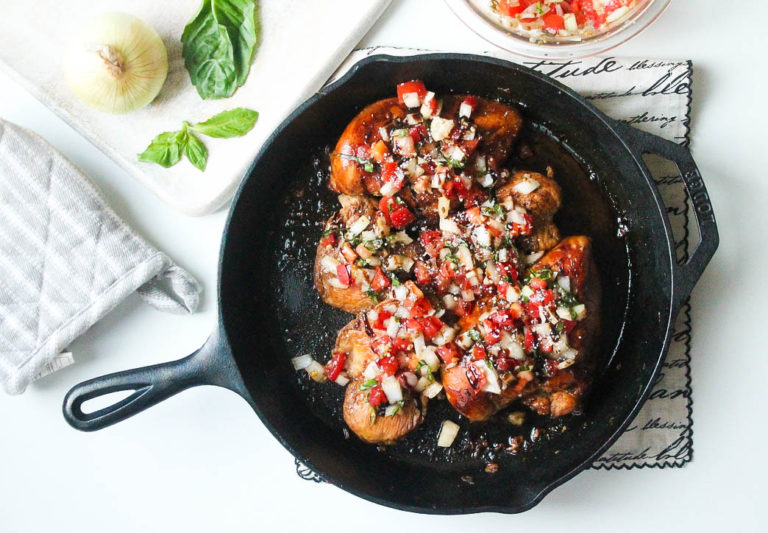
Where is `hanging bar`? hanging bar is located at coordinates (697, 188).